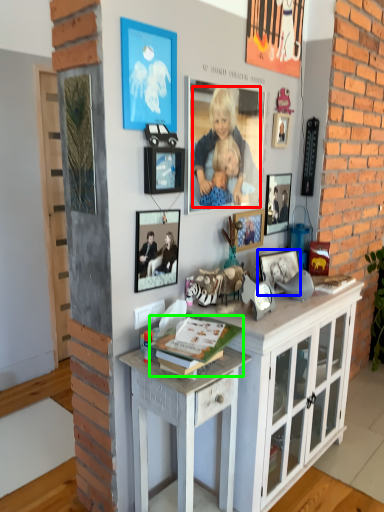
Question: Which object is the closest to the person (highlighted by a red box)? Choose among these: picture frame (highlighted by a blue box) or magazine (highlighted by a green box).

Choices:
 (A) picture frame
 (B) magazine

Answer: (A)